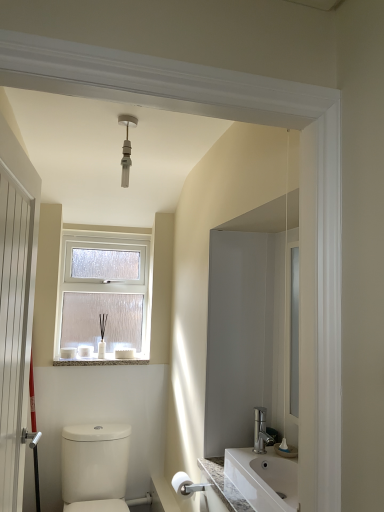
Question: From the image's perspective, is white frosted glass window at upper center under white marble window sill at lower center?

Choices:
 (A) yes
 (B) no

Answer: (B)

Question: Can you confirm if white frosted glass window at upper center is positioned to the left of white marble window sill at lower center?

Choices:
 (A) no
 (B) yes

Answer: (B)

Question: Does white frosted glass window at upper center have a greater width compared to white marble window sill at lower center?

Choices:
 (A) yes
 (B) no

Answer: (B)

Question: Is white marble window sill at lower center surrounded by white frosted glass window at upper center?

Choices:
 (A) no
 (B) yes

Answer: (A)

Question: From the image's perspective, is white frosted glass window at upper center over white marble window sill at lower center?

Choices:
 (A) no
 (B) yes

Answer: (B)

Question: Is white frosted glass window at upper center located outside white marble window sill at lower center?

Choices:
 (A) yes
 (B) no

Answer: (A)

Question: Does white glossy toilet at lower left have a greater height compared to white matte toilet paper at lower center?

Choices:
 (A) no
 (B) yes

Answer: (B)

Question: From the image's perspective, is white glossy toilet at lower left under white matte toilet paper at lower center?

Choices:
 (A) yes
 (B) no

Answer: (A)

Question: Is white glossy toilet at lower left positioned with its back to white matte toilet paper at lower center?

Choices:
 (A) no
 (B) yes

Answer: (A)

Question: Does white glossy toilet at lower left have a larger size compared to white matte toilet paper at lower center?

Choices:
 (A) no
 (B) yes

Answer: (B)

Question: Does white glossy toilet at lower left have a greater width compared to white matte toilet paper at lower center?

Choices:
 (A) no
 (B) yes

Answer: (B)

Question: Can we say white glossy toilet at lower left lies outside white matte toilet paper at lower center?

Choices:
 (A) yes
 (B) no

Answer: (A)

Question: From the image's perspective, does white marble window sill at lower center appear lower than white wooden door at left?

Choices:
 (A) yes
 (B) no

Answer: (A)